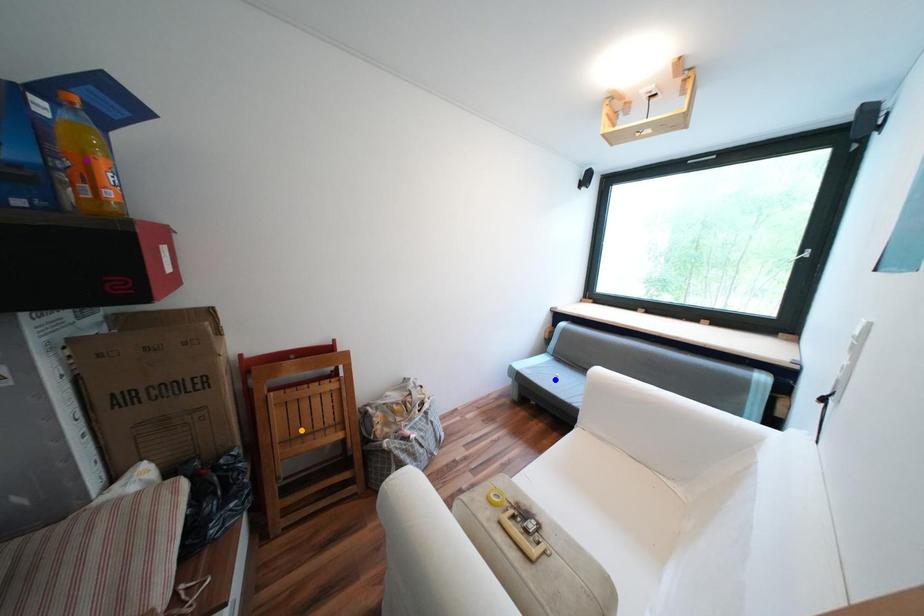
Order these from nearest to farthest:
- orange point
- blue point
- purple point

purple point, orange point, blue point